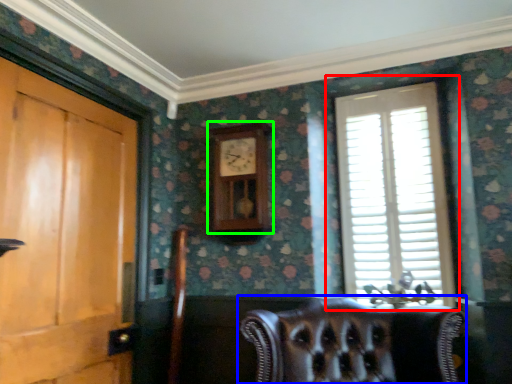
Question: Based on their relative distances, which object is nearer to window (highlighted by a red box)? Choose from chair (highlighted by a blue box) and clock (highlighted by a green box).

Choices:
 (A) chair
 (B) clock

Answer: (B)